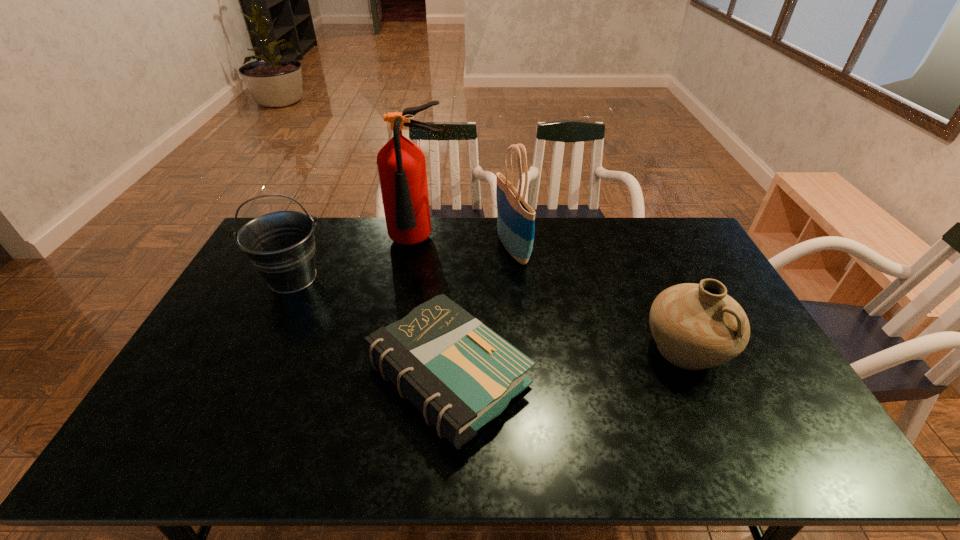
The image size is (960, 540). Identify the location of free spot located on the front of the fourth tallest object. (737, 463).

You are a GUI agent. You are given a task and a screenshot of the screen. Output one action in this format:
    pyautogui.click(x=<x>, y=<y>)
    Task: Click on the free space located on the right of the shortest object
    
    Given the screenshot: What is the action you would take?
    pyautogui.click(x=584, y=376)

Locate an element on the screen. This screenshot has height=540, width=960. fire extinguisher that is at the far edge is located at coordinates (401, 164).

What are the coordinates of `tote bag that is at the far edge` in the screenshot? It's located at (515, 218).

I want to click on object present at the near edge, so click(x=457, y=372).

Locate an element on the screen. Image resolution: width=960 pixels, height=540 pixels. object located at the left edge is located at coordinates (280, 245).

In order to click on object located in the right edge section of the desktop in this screenshot , I will do `click(695, 326)`.

At what (x,y) coordinates should I click in order to perform the action: click on vacant space at the far edge of the desktop. Please return your answer as a coordinate pair (x, y). The width and height of the screenshot is (960, 540). Looking at the image, I should click on (361, 226).

Image resolution: width=960 pixels, height=540 pixels. In the image, there is a desktop. Identify the location of free space at the near edge. (612, 464).

Identify the location of free spot at the left edge of the desktop. This screenshot has width=960, height=540. (226, 359).